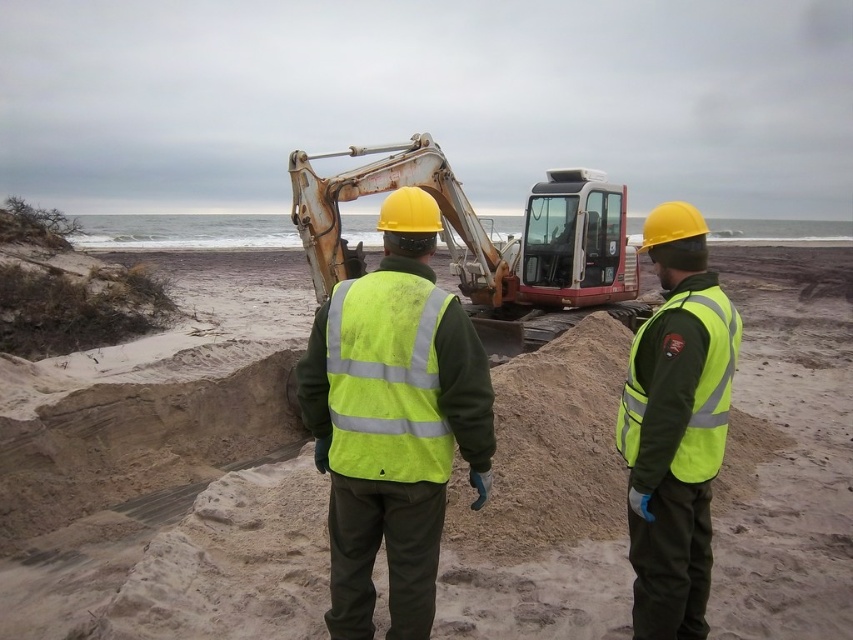
Question: From the image, what is the correct spatial relationship of high visibility vest at center in relation to high-visibility fabric vest at center?

Choices:
 (A) below
 (B) above

Answer: (A)

Question: Estimate the real-world distances between objects in this image. Which object is closer to the high-visibility fabric vest at center?

Choices:
 (A) high-visibility fabric safety vest at center
 (B) high visibility vest at center
 (C) high-visibility fabric safety vest at center-right

Answer: (C)

Question: Is high visibility vest at center wider than high-visibility fabric safety vest at center-right?

Choices:
 (A) yes
 (B) no

Answer: (A)

Question: Which point is farther to the camera?

Choices:
 (A) high visibility vest at center
 (B) rusty metal excavator at center

Answer: (B)

Question: Does sandy beach at center have a greater width compared to high-visibility fabric safety vest at center?

Choices:
 (A) no
 (B) yes

Answer: (B)

Question: Which of the following is the farthest from the observer?

Choices:
 (A) (355, 353)
 (B) (694, 294)
 (C) (177, 636)

Answer: (C)